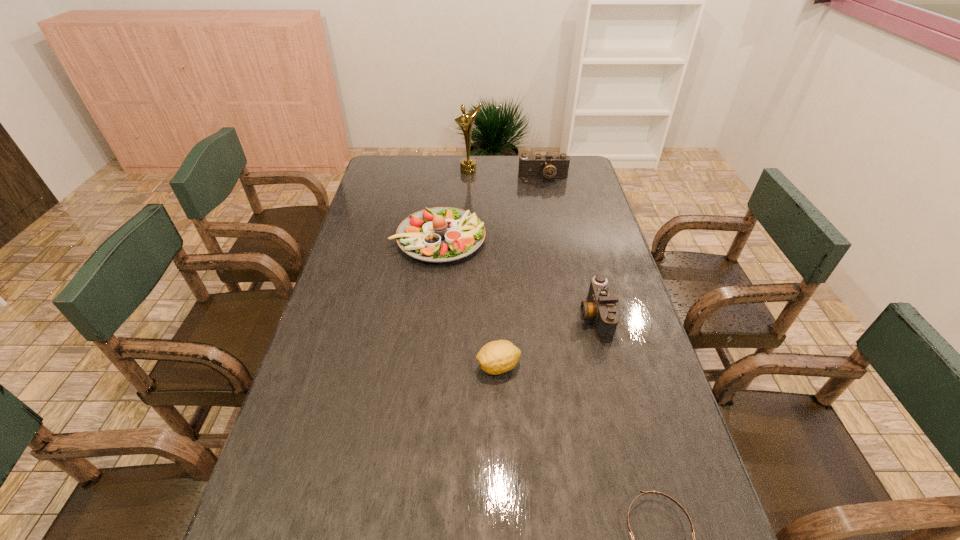
You are a GUI agent. You are given a task and a screenshot of the screen. Output one action in this format:
    pyautogui.click(x=<x>, y=<y>)
    Task: Click on the vacant space positioned on the lens of the nearer camera
    The width and height of the screenshot is (960, 540).
    Given the screenshot: What is the action you would take?
    pyautogui.click(x=448, y=316)

The height and width of the screenshot is (540, 960). I want to click on free location located 0.350m at the stem end of the fifth farthest object, so [339, 366].

What are the coordinates of `blank area located at the stem end of the fifth farthest object` in the screenshot? It's located at (414, 366).

Find the location of a particular element. The width and height of the screenshot is (960, 540). vacant space located at the stem end of the fifth farthest object is located at coordinates (390, 366).

Find the location of a particular element. award that is at the far edge is located at coordinates (467, 165).

Where is `camera positioned at the far edge`? This screenshot has width=960, height=540. camera positioned at the far edge is located at coordinates (538, 166).

Identify the location of object that is at the left edge. This screenshot has height=540, width=960. (441, 234).

Locate an element on the screen. Image resolution: width=960 pixels, height=540 pixels. object at the far right corner is located at coordinates 538,166.

The height and width of the screenshot is (540, 960). In the image, there is a desktop. What are the coordinates of `free space at the far edge` in the screenshot? It's located at point(508,165).

In the image, there is a desktop. Identify the location of vacant space at the left edge. This screenshot has width=960, height=540. (391, 215).